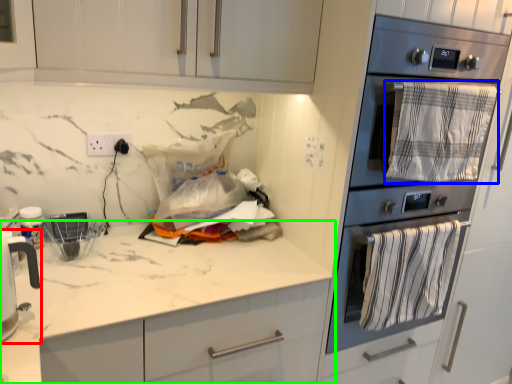
Question: Considering the real-world distances, which object is farthest from home appliance (highlighted by a red box)? blanket (highlighted by a blue box) or countertop (highlighted by a green box)?

Choices:
 (A) blanket
 (B) countertop

Answer: (A)